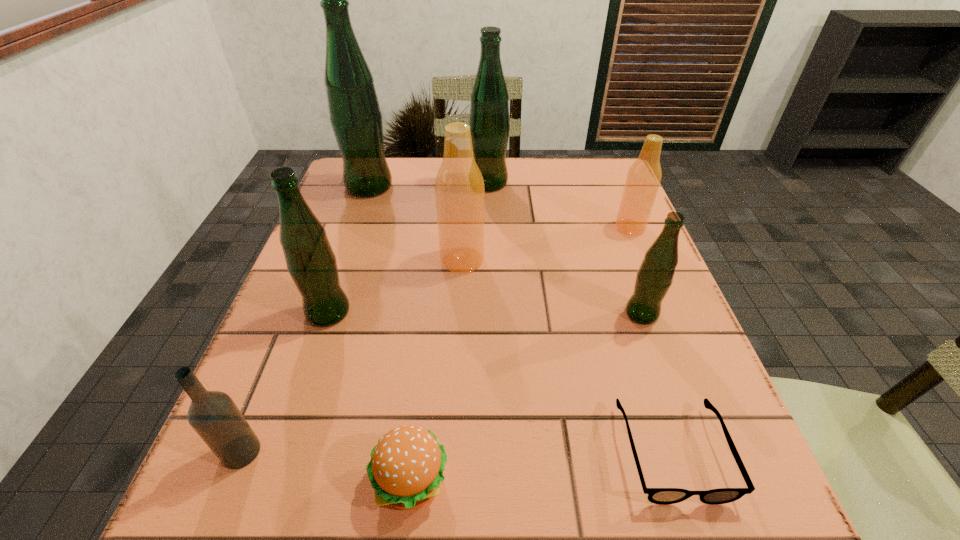
Image resolution: width=960 pixels, height=540 pixels. Find the location of `vacant space located 0.400m on the left of the right tan beer bottle`. vacant space located 0.400m on the left of the right tan beer bottle is located at coordinates (444, 227).

You are a GUI agent. You are given a task and a screenshot of the screen. Output one action in this format:
    pyautogui.click(x=<x>, y=<y>)
    Task: Click on the vacant space positioned on the right of the vodka
    Image resolution: width=960 pixels, height=540 pixels.
    Given the screenshot: What is the action you would take?
    pyautogui.click(x=411, y=452)

Where is `free location located 0.190m on the right of the eighth tallest object`? This screenshot has height=540, width=960. free location located 0.190m on the right of the eighth tallest object is located at coordinates (586, 482).

Where is `hamburger situated at the near edge`? hamburger situated at the near edge is located at coordinates (406, 468).

The width and height of the screenshot is (960, 540). I want to click on spectacles that is positioned at the near edge, so click(663, 496).

The image size is (960, 540). Identify the location of vodka situated at the left edge. (214, 416).

Locate an element on the screen. spectacles present at the right edge is located at coordinates (663, 496).

Where is `object at the far left corner`? The height and width of the screenshot is (540, 960). object at the far left corner is located at coordinates (354, 112).

The height and width of the screenshot is (540, 960). What are the coordinates of `object that is at the near right corner` in the screenshot? It's located at (663, 496).

In the image, there is a desktop. What are the coordinates of `free space at the far edge` in the screenshot? It's located at (420, 186).